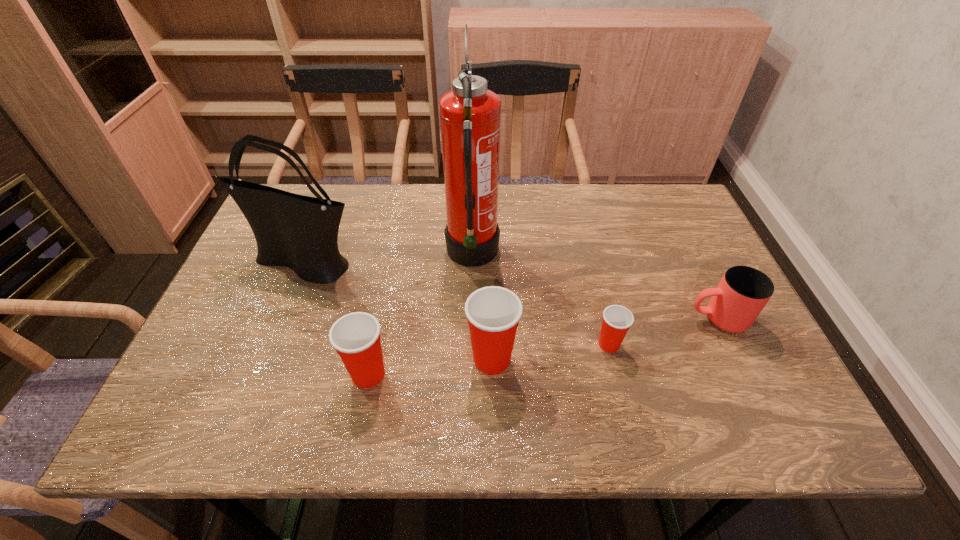
Identify the location of the second tallest Dixie cup. (356, 336).

I want to click on the fifth object from right to left, so click(x=356, y=336).

At what (x,y) coordinates should I click in order to perform the action: click on the second Dixie cup from right to left. Please return your answer as a coordinate pair (x, y). Looking at the image, I should click on (493, 313).

I want to click on the shortest Dixie cup, so click(x=617, y=320).

The height and width of the screenshot is (540, 960). In order to click on the rightmost Dixie cup in this screenshot , I will do `click(617, 320)`.

This screenshot has height=540, width=960. In order to click on the leftmost object in this screenshot , I will do `click(300, 232)`.

I want to click on shoulder bag, so click(x=300, y=232).

You are a GUI agent. You are given a task and a screenshot of the screen. Output one action in this format:
    pyautogui.click(x=<x>, y=<y>)
    Task: Click on the tallest object
    This screenshot has width=960, height=540.
    Given the screenshot: What is the action you would take?
    pyautogui.click(x=470, y=115)

Where is `cup`? cup is located at coordinates point(743,292).

Locate an element on the screen. The image size is (960, 540). the second shortest object is located at coordinates (743, 292).